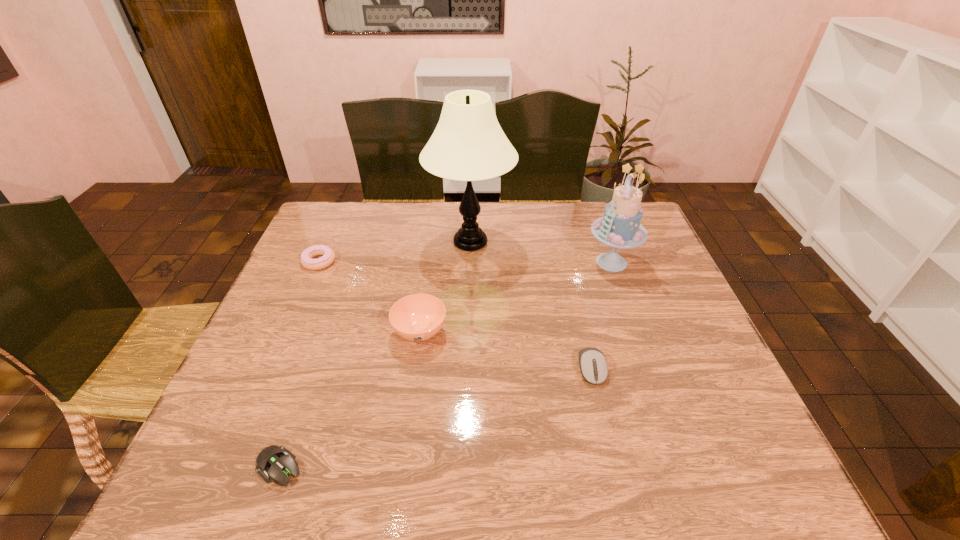
At what (x,y) coordinates should I click in order to perform the action: click on computer mouse that is positioned at the left edge. Please return your answer as a coordinate pair (x, y). This screenshot has height=540, width=960. Looking at the image, I should click on (275, 462).

I want to click on object that is positioned at the right edge, so click(620, 227).

What are the coordinates of `object positioned at the near left corner` in the screenshot? It's located at (275, 462).

Locate an element on the screen. free space at the far edge is located at coordinates (442, 215).

Image resolution: width=960 pixels, height=540 pixels. Identify the location of blank space at the near edge. (347, 484).

Find the location of a particular element. Image resolution: width=960 pixels, height=540 pixels. vacant space at the left edge of the desktop is located at coordinates (343, 269).

I want to click on free region at the right edge of the desktop, so click(x=709, y=380).

Where is `vacant area at the near right corner`? The height and width of the screenshot is (540, 960). vacant area at the near right corner is located at coordinates (733, 489).

This screenshot has height=540, width=960. I want to click on vacant area between the nearer computer mouse and the lamp, so click(375, 354).

This screenshot has height=540, width=960. Find the location of `unoccupied position between the second tallest object and the farther computer mouse`. unoccupied position between the second tallest object and the farther computer mouse is located at coordinates (601, 315).